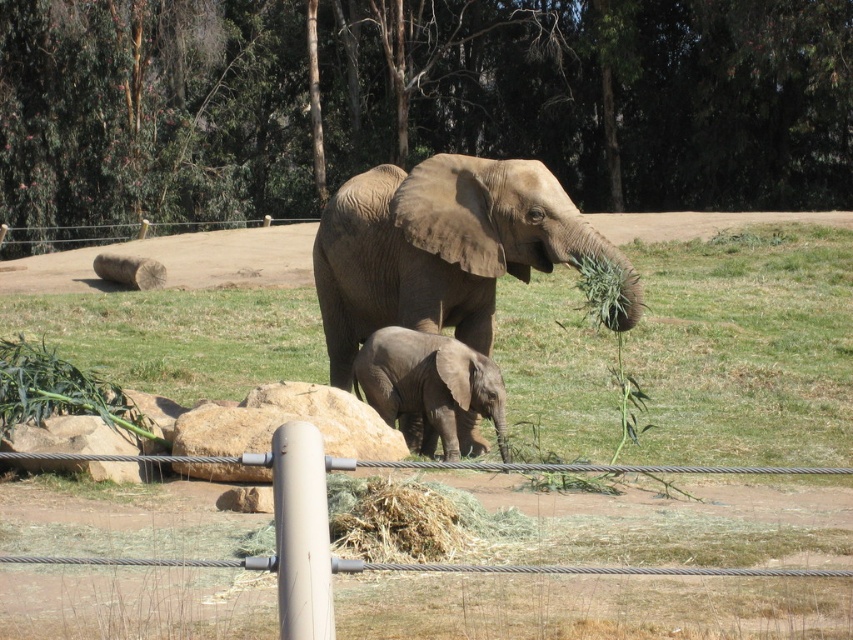
In the scene shown: Which of these two, gray textured elephant at center or gray matte elephant at center, stands taller?

gray matte elephant at center is taller.

Image resolution: width=853 pixels, height=640 pixels. I want to click on gray textured elephant at center, so click(x=442, y=248).

This screenshot has width=853, height=640. Describe the element at coordinates (442, 248) in the screenshot. I see `gray textured elephant at center` at that location.

Where is `gray textured elephant at center`? This screenshot has height=640, width=853. gray textured elephant at center is located at coordinates (442, 248).

Is point (242, 49) farther from camera compared to point (367, 250)?

Yes, point (242, 49) is farther from viewer.

Locate an element on the screen. This screenshot has height=640, width=853. green leafy tree at upper center is located at coordinates (415, 102).

Who is higher up, green leafy tree at upper center or gray matte elephant at center?

Positioned higher is green leafy tree at upper center.

Can you confirm if green leafy tree at upper center is positioned above gray matte elephant at center?

Yes, green leafy tree at upper center is above gray matte elephant at center.

Is point (728, 112) farther from camera compared to point (480, 356)?

Yes, point (728, 112) is farther from viewer.

Locate an element on the screen. The height and width of the screenshot is (640, 853). green leafy tree at upper center is located at coordinates (415, 102).